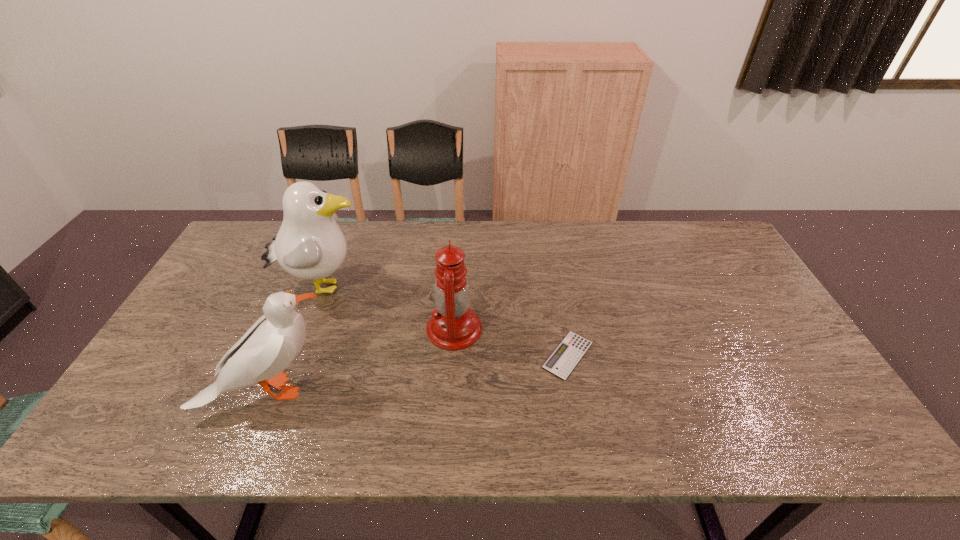
This screenshot has height=540, width=960. In order to click on free location that satisfies the following two spatial constraints: 1. on the back side of the oil lamp; 2. on the beak of the farther gull in this screenshot , I will do `click(457, 286)`.

Identify the location of free point that satisfies the following two spatial constraints: 1. on the beak of the oil lamp; 2. on the left side of the farther gull. The height and width of the screenshot is (540, 960). (306, 329).

The width and height of the screenshot is (960, 540). In order to click on free space that satisfies the following two spatial constraints: 1. on the beak of the shortest object; 2. on the left side of the farther gull in this screenshot , I will do `click(297, 355)`.

Where is `vacant space that satisfies the following two spatial constraints: 1. on the beak of the calculator; 2. on the left side of the farther gull`? The height and width of the screenshot is (540, 960). vacant space that satisfies the following two spatial constraints: 1. on the beak of the calculator; 2. on the left side of the farther gull is located at coordinates (297, 355).